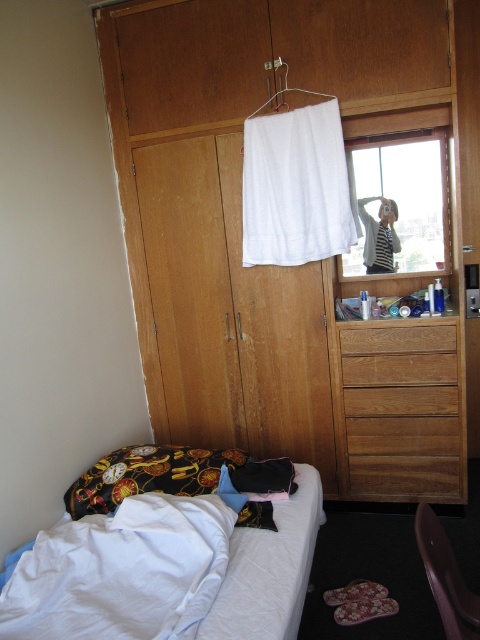
Question: Among these objects, which one is farthest from the camera?

Choices:
 (A) white fabric towel at upper center
 (B) white cotton bed at lower left
 (C) wooden chair at lower right
 (D) brown wooden drawer at right

Answer: (D)

Question: Does brown wooden drawer at right have a larger size compared to white fabric hanger at upper center?

Choices:
 (A) no
 (B) yes

Answer: (B)

Question: Can you confirm if wooden dresser at center is positioned to the right of wooden drawer at center?

Choices:
 (A) no
 (B) yes

Answer: (A)

Question: Estimate the real-world distances between objects in this image. Which object is farther from the wooden chair at lower right?

Choices:
 (A) transparent glass window at upper center
 (B) wooden dresser at center
 (C) white fabric towel at upper center

Answer: (A)

Question: Among these points, which one is farthest from the camera?

Choices:
 (A) (400, 344)
 (B) (372, 132)

Answer: (A)

Question: Is white cotton bed at lower left smaller than velvet blue pillow at lower center?

Choices:
 (A) yes
 (B) no

Answer: (B)